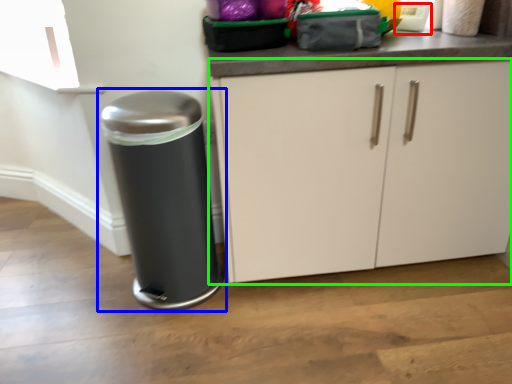
Question: Which is farther away from appliance (highlighted by a red box)? waste container (highlighted by a blue box) or cabinetry (highlighted by a green box)?

Choices:
 (A) waste container
 (B) cabinetry

Answer: (A)